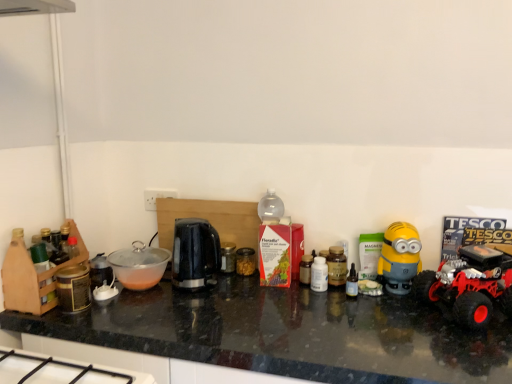
Question: Is red rubber toy truck at right inside the boundaries of black plastic kettle at center, or outside?

Choices:
 (A) outside
 (B) inside

Answer: (A)

Question: From a real-world perspective, is red rubber toy truck at right physically located above or below black plastic kettle at center?

Choices:
 (A) above
 (B) below

Answer: (B)

Question: Considering the real-world distances, which object is closest to the brown glass bottle at center, which is the 2th bottle from right to left?

Choices:
 (A) translucent plastic jar at center, positioned as the 1th toy in back-to-front order
 (B) transparent plastic bowl at center
 (C) black granite countertop at center
 (D) yellow matte minion toy at right, which appears as the 2th toy when viewed from the back
 (E) metallic black kettle at center

Answer: (D)

Question: Considering the real-world distances, which object is farthest from the translucent plastic jar at center, the 1th toy in the left-to-right sequence?

Choices:
 (A) metallic black kettle at center
 (B) yellow matte minion toy at right, which appears as the 2th toy when viewed from the back
 (C) white plastic bottle at center, marked as the third bottle in a right-to-left arrangement
 (D) brown glass bottle at center, which is the 2th bottle from right to left
 (E) black granite countertop at center

Answer: (B)